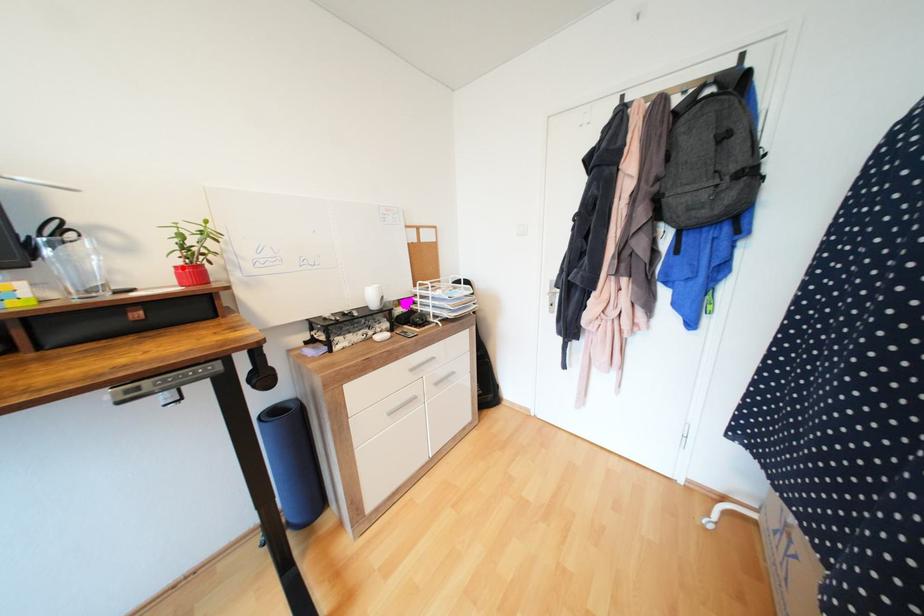
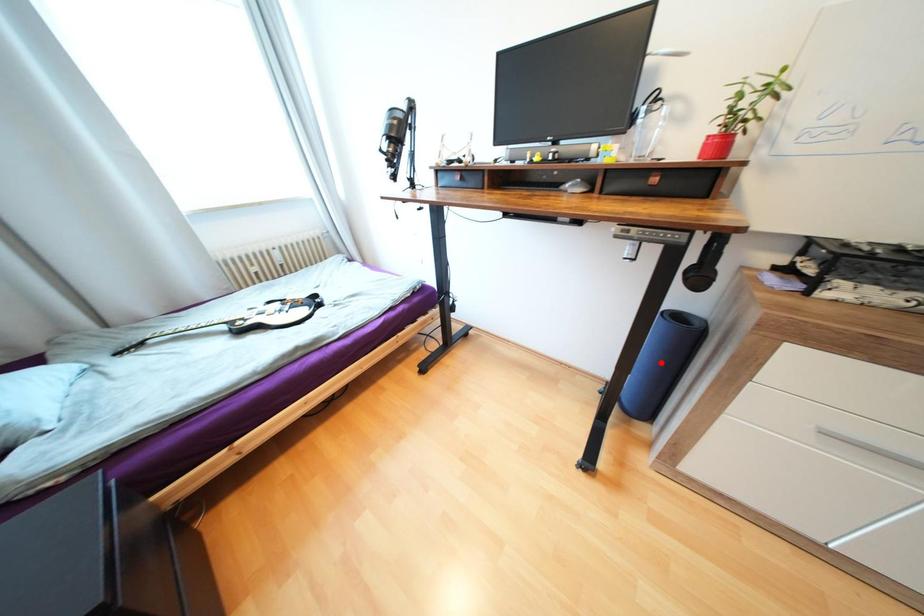
I am providing you with two images of the same scene from different viewpoints. A red point is marked on the first image and another point is marked on the second image. Is the red point in image1 aligned with the point shown in image2?

No